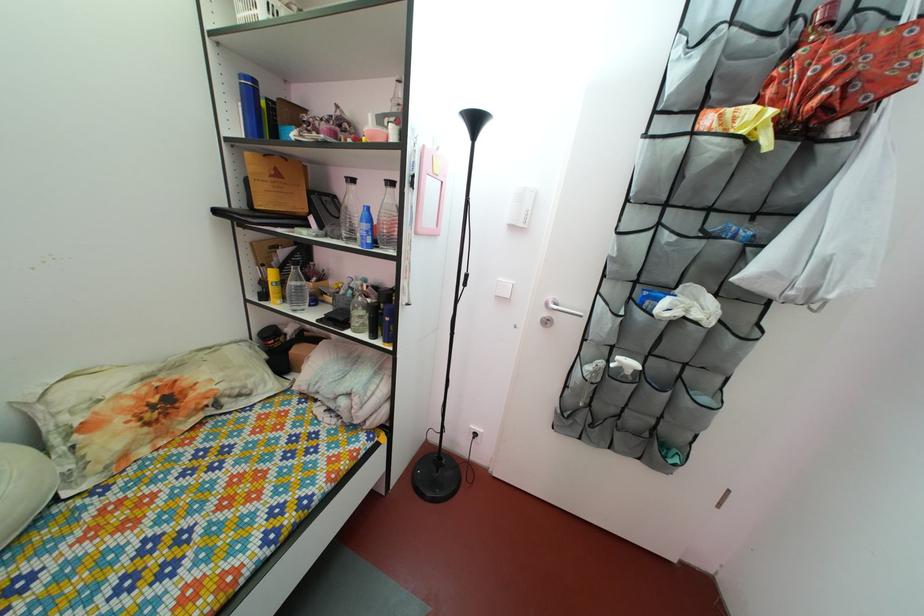
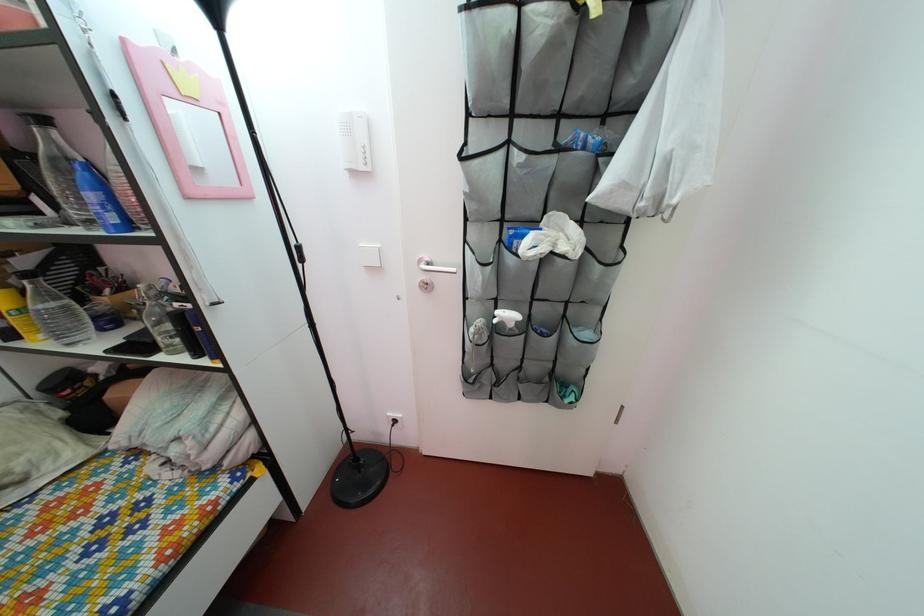
The point at (568,310) is marked in the first image. Where is the corresponding point in the second image?

(443, 268)